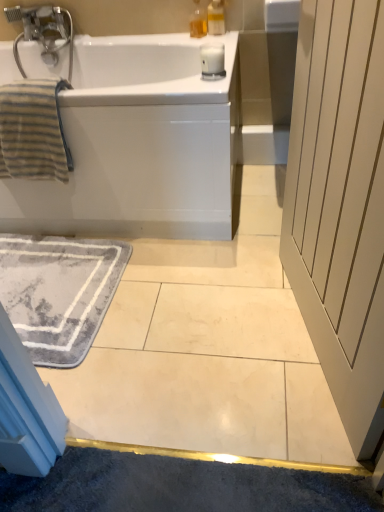
This screenshot has height=512, width=384. I want to click on free location to the left of white wood screen door at right, so click(200, 343).